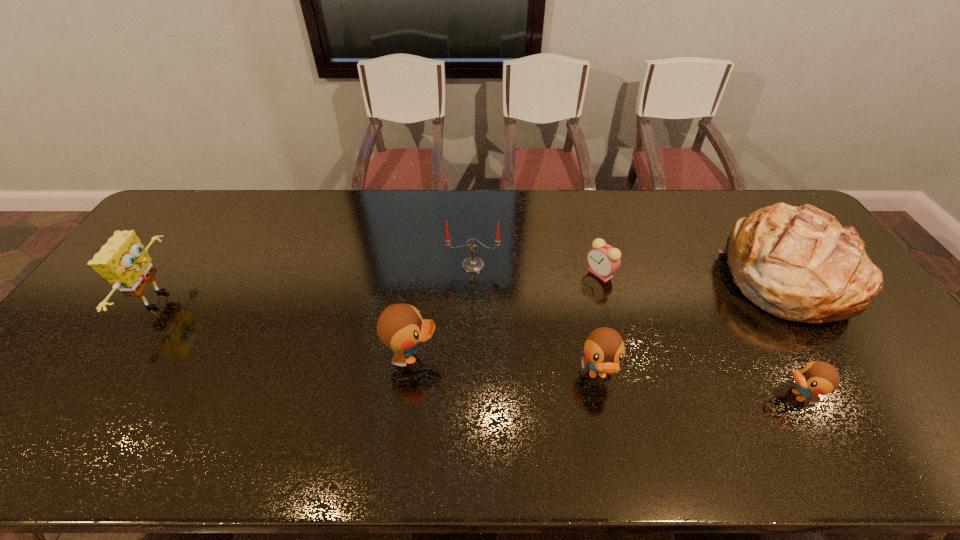
The width and height of the screenshot is (960, 540). I want to click on vacant space situated on the front-facing side of the shortest duck, so click(x=660, y=395).

The image size is (960, 540). What are the coordinates of `vacant space located 0.070m on the front-facing side of the shortest duck` in the screenshot? It's located at (749, 395).

Identify the location of free space located on the front-facing side of the candle. (472, 300).

Find the location of a particular element. The width and height of the screenshot is (960, 540). free space located 0.360m on the left of the bread is located at coordinates (605, 273).

You are a GUI agent. You are given a task and a screenshot of the screen. Output one action in this format:
    pyautogui.click(x=<x>, y=<y>)
    Task: Click on the vacant space located on the face of the sponge
    The width and height of the screenshot is (960, 540).
    Given the screenshot: What is the action you would take?
    pos(311,299)

At what (x,y) coordinates should I click in order to perform the action: click on vacant area situated 0.370m on the face of the alarm clock. Please return your answer as a coordinate pair (x, y). Looking at the image, I should click on (464, 273).

Locate an element on the screen. The image size is (960, 540). free region located on the face of the alarm clock is located at coordinates (526, 273).

Where is `free region located 0.260m on the face of the alarm clock`? free region located 0.260m on the face of the alarm clock is located at coordinates pyautogui.click(x=500, y=273).

I want to click on object located at the far edge, so pyautogui.click(x=798, y=263).

Where is `object that is at the left edge`? object that is at the left edge is located at coordinates (123, 261).